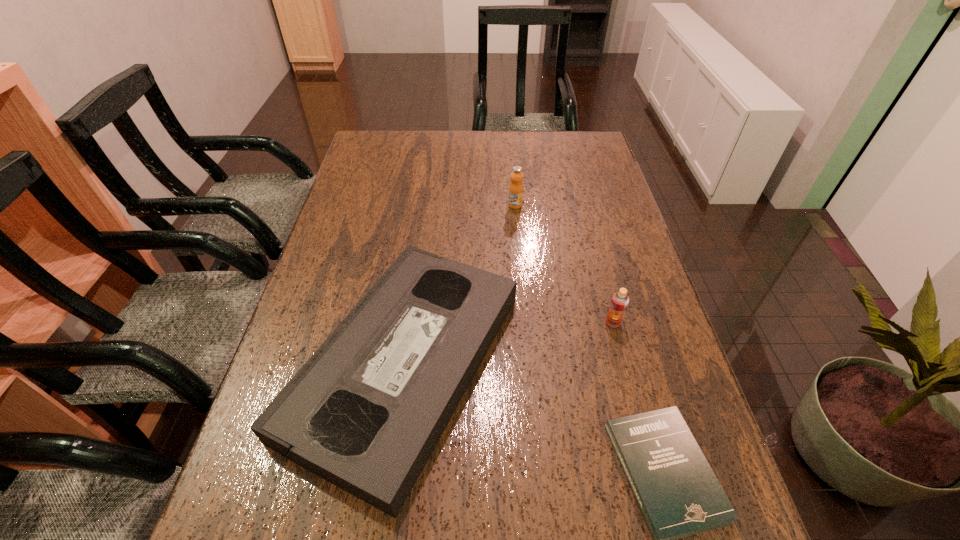
Find the location of `the farther orange juice`. the farther orange juice is located at coordinates (516, 187).

The image size is (960, 540). In order to click on the third object from right to left in this screenshot , I will do `click(516, 187)`.

Where is `the right orange juice`? The width and height of the screenshot is (960, 540). the right orange juice is located at coordinates (619, 302).

At what (x,y) coordinates should I click in order to perform the action: click on the leftmost object. Please return your answer as a coordinate pair (x, y). The height and width of the screenshot is (540, 960). Looking at the image, I should click on (365, 412).

Locate an element on the screen. the third tallest object is located at coordinates (365, 412).

Image resolution: width=960 pixels, height=540 pixels. In order to click on free spot located on the front label of the farthest object in this screenshot , I will do `click(524, 301)`.

The height and width of the screenshot is (540, 960). In order to click on free space located on the front of the nearer orange juice in this screenshot , I will do `click(625, 371)`.

You are a GUI agent. You are given a task and a screenshot of the screen. Output one action in this format:
    pyautogui.click(x=<x>, y=<y>)
    Task: Click on the vacant space located 0.150m on the back of the leftmost object
    Image resolution: width=960 pixels, height=540 pixels.
    Given the screenshot: What is the action you would take?
    pyautogui.click(x=424, y=228)

You are a GUI agent. You are given a task and a screenshot of the screen. Output one action in this format:
    pyautogui.click(x=<x>, y=<y>)
    Task: Click on the object located in the left edge section of the desktop
    Image resolution: width=960 pixels, height=540 pixels.
    Given the screenshot: What is the action you would take?
    pyautogui.click(x=365, y=412)

Locate an element on the screen. object at the right edge is located at coordinates (619, 302).